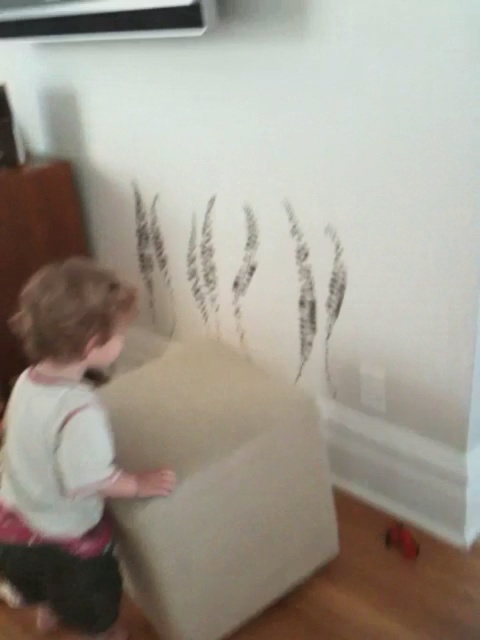
You are a parent trying to clean up the room. The white cotton toddler at center is currently standing in the way of the black paper at center. Can you safely move the toddler to retrieve the paper without getting too close?

The white cotton toddler at center and black paper at center are 32.15 inches apart. Since the distance is sufficient, you can move the toddler to a safe distance away from the black paper at center to retrieve it without any issues.

You are a parent looking at the scene. You see the point marked at coordinates (x=67, y=449). What does this point indicate in the image?

The point marked at coordinates (x=67, y=449) indicates the location of the white cotton toddler at center.